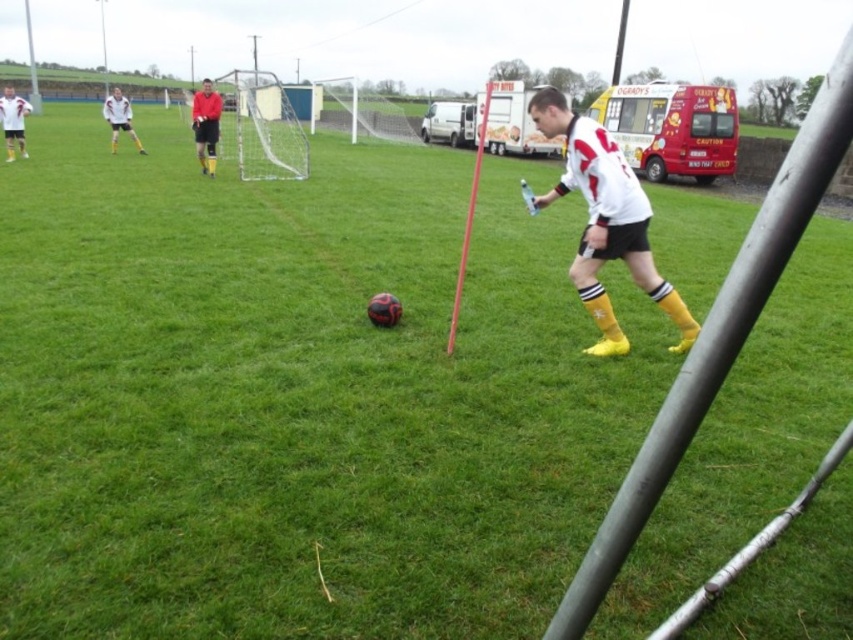
Question: Does white matte jersey at center lie behind matte red shirt at center?

Choices:
 (A) no
 (B) yes

Answer: (A)

Question: Estimate the real-world distances between objects in this image. Which object is farther from the matte red shirt at center?

Choices:
 (A) white matte jersey at center
 (B) white matte jersey at upper left

Answer: (A)

Question: Estimate the real-world distances between objects in this image. Which object is farther from the white matte jersey at upper left?

Choices:
 (A) matte red shirt at center
 (B) white matte jersey at center

Answer: (B)

Question: Is white matte jersey at center wider than matte red shirt at center?

Choices:
 (A) no
 (B) yes

Answer: (A)

Question: Which of the following is the farthest from the observer?

Choices:
 (A) white matte jersey at upper left
 (B) matte red shirt at center
 (C) white matte jersey at center

Answer: (A)

Question: Does white matte jersey at center lie behind white matte jersey at upper left?

Choices:
 (A) yes
 (B) no

Answer: (B)